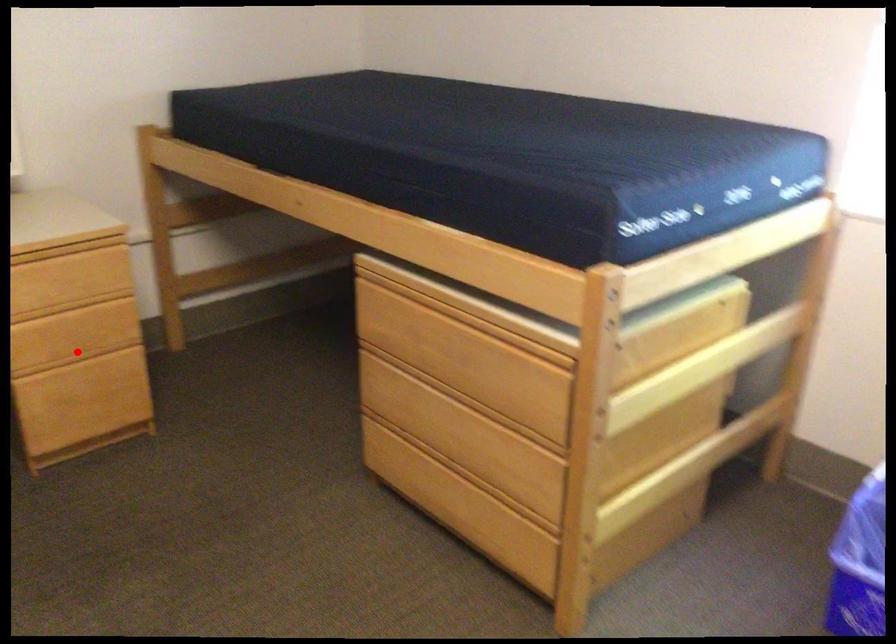
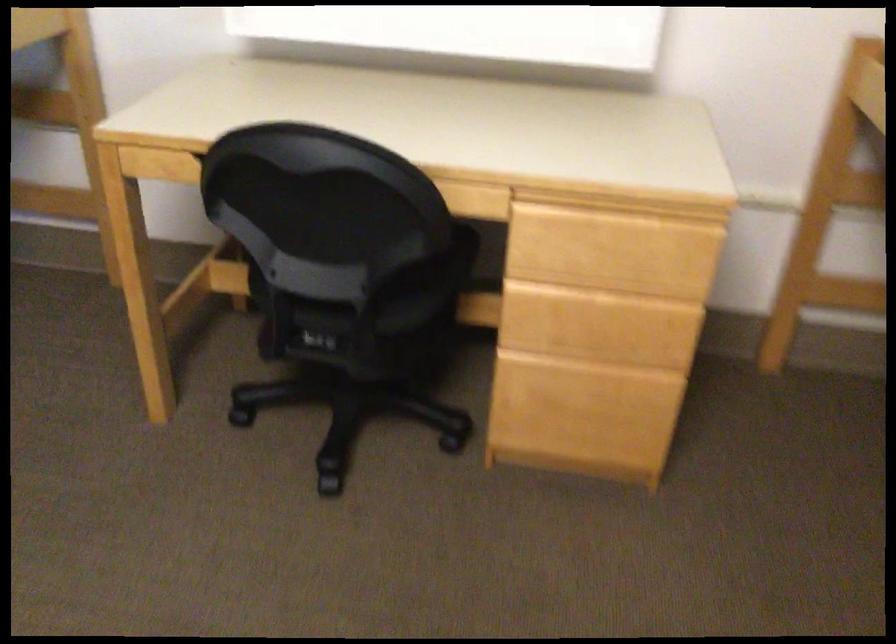
Question: A red point is marked in image1. In image2, is the corresponding 3D point closer to the camera or farther? Reply with the corresponding letter.

Choices:
 (A) The corresponding 3D point is closer.
 (B) The corresponding 3D point is farther.

Answer: (A)